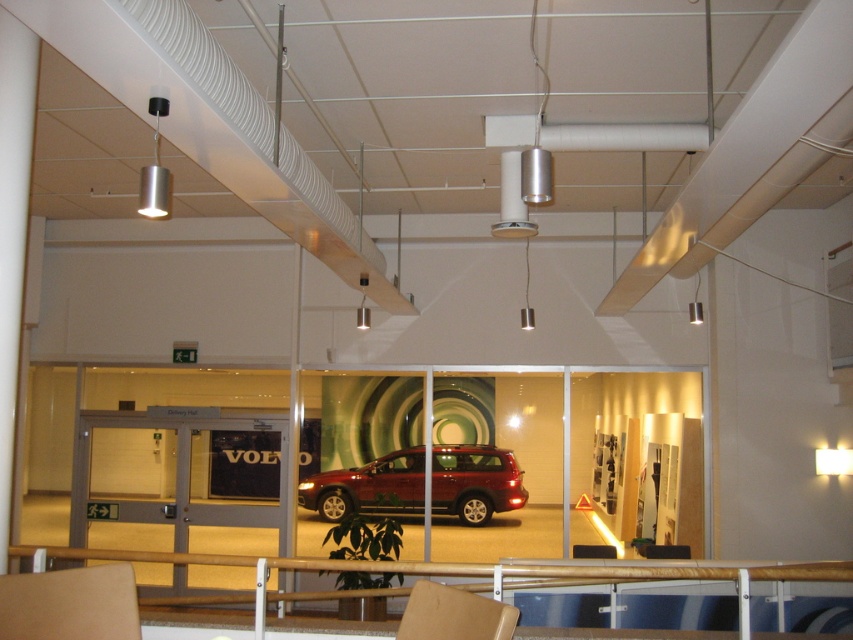
Question: Can you confirm if shiny metallic car at center is bigger than matte brown chair at lower left?

Choices:
 (A) no
 (B) yes

Answer: (B)

Question: Which object is closer to the camera taking this photo?

Choices:
 (A) shiny metallic car at center
 (B) matte brown chair at center
 (C) matte brown chair at lower left

Answer: (B)

Question: Can you confirm if shiny metallic car at center is wider than matte brown chair at center?

Choices:
 (A) no
 (B) yes

Answer: (B)

Question: Among these points, which one is farthest from the camera?

Choices:
 (A) (26, 600)
 (B) (384, 465)
 (C) (416, 634)

Answer: (B)

Question: Which point is farther from the camera taking this photo?

Choices:
 (A) (518, 611)
 (B) (108, 624)
 (C) (468, 509)

Answer: (C)

Question: Can you confirm if matte brown chair at lower left is positioned to the left of matte brown chair at center?

Choices:
 (A) yes
 (B) no

Answer: (A)